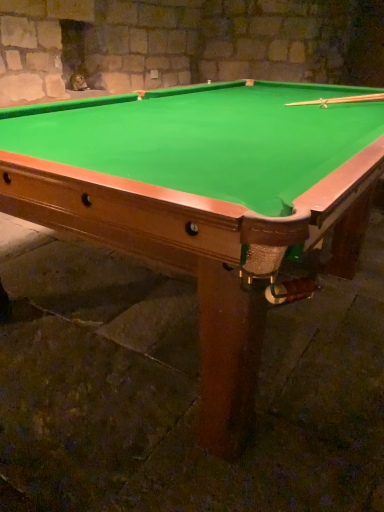
Measure the distance between point (292, 134) and camera.

The depth of point (292, 134) is 5.41 feet.

Find the location of a particular element. green felt pool table at center is located at coordinates (204, 200).

The image size is (384, 512). What do you see at coordinates (204, 200) in the screenshot? I see `green felt pool table at center` at bounding box center [204, 200].

This screenshot has width=384, height=512. What do you see at coordinates (340, 100) in the screenshot? I see `wooden cue at upper right` at bounding box center [340, 100].

Where is `wooden cue at upper right`? wooden cue at upper right is located at coordinates (340, 100).

In order to click on green felt pool table at center in this screenshot , I will do `click(204, 200)`.

Does green felt pool table at center appear on the right side of wooden cue at upper right?

In fact, green felt pool table at center is to the left of wooden cue at upper right.

Which object is further away from the camera, green felt pool table at center or wooden cue at upper right?

wooden cue at upper right is more distant.

Is point (70, 205) closer or farther from the camera than point (304, 105)?

Point (70, 205).

From the image's perspective, is green felt pool table at center on top of wooden cue at upper right?

No, from the image's perspective, green felt pool table at center is not over wooden cue at upper right.

From a real-world perspective, relative to wooden cue at upper right, is green felt pool table at center vertically above or below?

green felt pool table at center is situated lower than wooden cue at upper right in the real world.

Considering the relative sizes of green felt pool table at center and wooden cue at upper right in the image provided, is green felt pool table at center thinner than wooden cue at upper right?

No.

Which of these two, green felt pool table at center or wooden cue at upper right, stands taller?

green felt pool table at center.

From the picture: Can you confirm if green felt pool table at center is smaller than wooden cue at upper right?

No, green felt pool table at center is not smaller than wooden cue at upper right.

Is green felt pool table at center surrounding wooden cue at upper right?

Indeed, wooden cue at upper right is located within green felt pool table at center.

Is green felt pool table at center not close to wooden cue at upper right?

green felt pool table at center is positioned a significant distance from wooden cue at upper right.

Is green felt pool table at center aimed at wooden cue at upper right?

No, green felt pool table at center is not facing towards wooden cue at upper right.

What's the angular difference between green felt pool table at center and wooden cue at upper right's facing directions?

They differ by 60.3 degrees in their facing directions.

Looking at this image, measure the distance between green felt pool table at center and wooden cue at upper right.

green felt pool table at center is 3.49 feet away from wooden cue at upper right.

Image resolution: width=384 pixels, height=512 pixels. Identify the location of billiard table in front of the wooden cue at upper right. (204, 200).

Is wooden cue at upper right to the left of green felt pool table at center from the viewer's perspective?

No, wooden cue at upper right is not to the left of green felt pool table at center.

Which object is closer to the camera taking this photo, wooden cue at upper right or green felt pool table at center?

green felt pool table at center is closer to the camera.

Is point (304, 104) closer or farther from the camera than point (282, 119)?

Point (304, 104) is farther from the camera than point (282, 119).

From the image's perspective, which object appears higher, wooden cue at upper right or green felt pool table at center?

wooden cue at upper right, from the image's perspective.

From a real-world perspective, is wooden cue at upper right physically located above or below green felt pool table at center?

Clearly, from a real-world perspective, wooden cue at upper right is above green felt pool table at center.

Considering the relative sizes of wooden cue at upper right and green felt pool table at center in the image provided, is wooden cue at upper right thinner than green felt pool table at center?

Yes, wooden cue at upper right is thinner than green felt pool table at center.

Who is shorter, wooden cue at upper right or green felt pool table at center?

Standing shorter between the two is wooden cue at upper right.

Based on their sizes in the image, would you say wooden cue at upper right is bigger or smaller than green felt pool table at center?

Considering their sizes, wooden cue at upper right takes up less space than green felt pool table at center.

Is wooden cue at upper right inside or outside of green felt pool table at center?

wooden cue at upper right is inside green felt pool table at center.

Is wooden cue at upper right positioned far away from green felt pool table at center?

wooden cue at upper right is positioned a significant distance from green felt pool table at center.

Based on the photo, is wooden cue at upper right oriented away from green felt pool table at center?

Yes.

From the picture: How different are the orientations of wooden cue at upper right and green felt pool table at center in degrees?

There is a 60.3-degree angle between the facing directions of wooden cue at upper right and green felt pool table at center.

You are a GUI agent. You are given a task and a screenshot of the screen. Output one action in this format:
    pyautogui.click(x=<x>, y=<y>)
    Task: Click on the billiard table located in front of the wooden cue at upper right
    The image size is (384, 512).
    Given the screenshot: What is the action you would take?
    pyautogui.click(x=204, y=200)

Find the location of a particular element. cue behind the green felt pool table at center is located at coordinates (340, 100).

In the image, there is a wooden cue at upper right. Find the location of `billiard table below it (from the image's perspective)`. billiard table below it (from the image's perspective) is located at coordinates (204, 200).